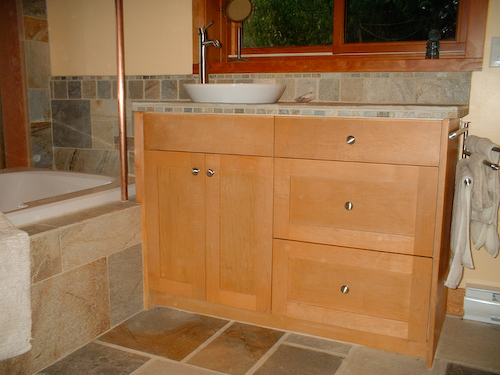
Where is `brown and gray tones tile wall`? The image size is (500, 375). brown and gray tones tile wall is located at coordinates (82, 126).